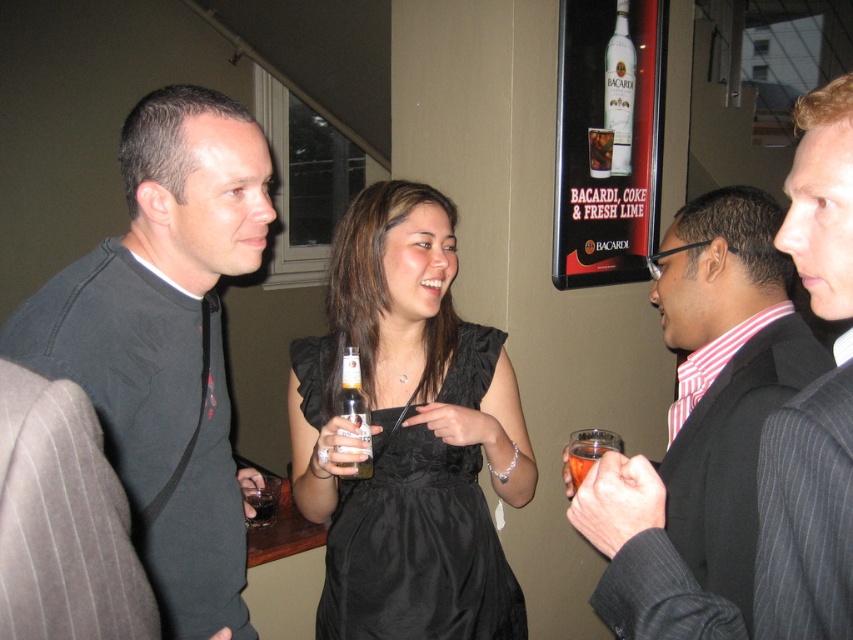
Question: Which object appears farthest from the camera in this image?

Choices:
 (A) gray pinstripe suit at right
 (B) translucent glass cup at lower center
 (C) white glass bottle at upper center

Answer: (C)

Question: Does black matte shirt at left appear under gray pinstripe suit at right?

Choices:
 (A) yes
 (B) no

Answer: (A)

Question: Which is farther from the translucent glass at lower left?

Choices:
 (A) striped cotton shirt at center
 (B) white glass bottle at upper center
 (C) translucent glass cup at lower center

Answer: (B)

Question: Does black satin dress at center appear on the left side of gray pinstripe suit at right?

Choices:
 (A) no
 (B) yes

Answer: (B)

Question: Which point is closer to the camera taking this photo?

Choices:
 (A) (379, 433)
 (B) (822, 486)
 (C) (631, 64)

Answer: (B)

Question: Is translucent glass bottle at center closer to the viewer compared to translucent glass at lower left?

Choices:
 (A) no
 (B) yes

Answer: (B)